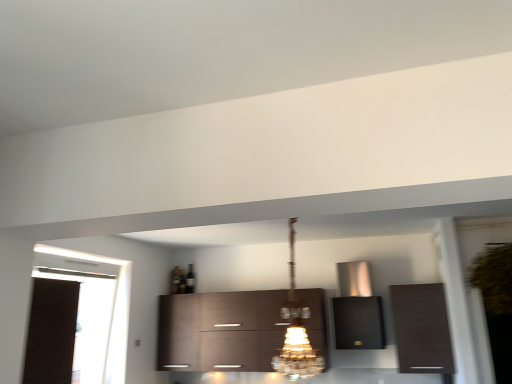
Question: Which direction should I rotate to look at dark wood cabinet at center, acting as the 3th cabinetry starting from the right?

Choices:
 (A) left
 (B) right

Answer: (A)

Question: Can you confirm if dark wood cabinet at center, acting as the 3th cabinetry starting from the right, is bigger than black fabric curtain at left?

Choices:
 (A) no
 (B) yes

Answer: (B)

Question: Does dark wood cabinet at center, the first cabinetry viewed from the left, have a lesser width compared to black fabric curtain at left?

Choices:
 (A) no
 (B) yes

Answer: (A)

Question: From the image's perspective, does dark wood cabinet at center, acting as the 3th cabinetry starting from the right, appear lower than black fabric curtain at left?

Choices:
 (A) no
 (B) yes

Answer: (B)

Question: Is dark wood cabinet at center, the first cabinetry viewed from the left, in contact with black fabric curtain at left?

Choices:
 (A) no
 (B) yes

Answer: (A)

Question: Considering the relative sizes of dark wood cabinet at center, acting as the 3th cabinetry starting from the right, and black fabric curtain at left in the image provided, is dark wood cabinet at center, acting as the 3th cabinetry starting from the right, wider than black fabric curtain at left?

Choices:
 (A) no
 (B) yes

Answer: (B)

Question: Is dark wood cabinet at center, acting as the 3th cabinetry starting from the right, positioned in front of black fabric curtain at left?

Choices:
 (A) yes
 (B) no

Answer: (B)

Question: Would you consider dark wood cabinet at right, which is the third cabinetry in left-to-right order, to be distant from satin metallic range hood at center, placed as the second cabinetry when sorted from right to left?

Choices:
 (A) no
 (B) yes

Answer: (A)

Question: Would you say dark wood cabinet at right, which is the third cabinetry in left-to-right order, is outside satin metallic range hood at center, the 2th cabinetry viewed from the left?

Choices:
 (A) yes
 (B) no

Answer: (A)

Question: Can you confirm if dark wood cabinet at right, which is the third cabinetry in left-to-right order, is taller than satin metallic range hood at center, placed as the second cabinetry when sorted from right to left?

Choices:
 (A) no
 (B) yes

Answer: (A)

Question: From a real-world perspective, is dark wood cabinet at right, the first cabinetry viewed from the right, over satin metallic range hood at center, placed as the second cabinetry when sorted from right to left?

Choices:
 (A) yes
 (B) no

Answer: (B)

Question: Is satin metallic range hood at center, the 2th cabinetry viewed from the left, completely or partially inside dark wood cabinet at right, which is the third cabinetry in left-to-right order?

Choices:
 (A) no
 (B) yes

Answer: (A)

Question: Does dark wood cabinet at right, the first cabinetry viewed from the right, have a lesser width compared to satin metallic range hood at center, placed as the second cabinetry when sorted from right to left?

Choices:
 (A) no
 (B) yes

Answer: (B)

Question: Can you confirm if satin metallic range hood at center, placed as the second cabinetry when sorted from right to left, is positioned to the right of black fabric curtain at left?

Choices:
 (A) yes
 (B) no

Answer: (A)